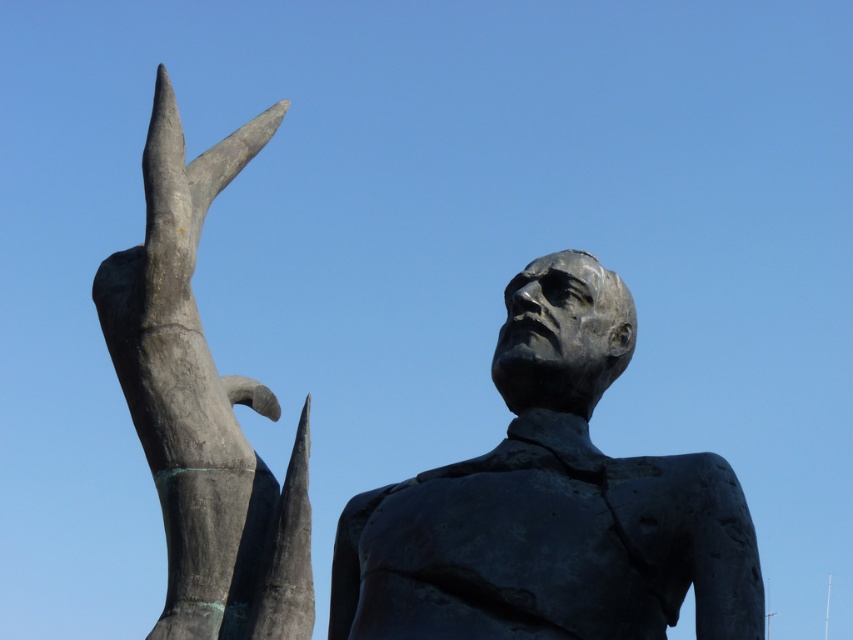
You are a photographer trying to capture the statue in the image. You want to ensure your camera is focused on the bronze statue at upper center. Given that the camera can only focus on objects within a 0.1 radius of the point you select, would the point you chose at point (550, 504) be within the focus range?

The bronze statue at upper center is located exactly at point (550, 504), so the camera will be able to focus on it since the point is within the focus range of 0.1 radius.

You are a tour guide leading a group near two bronze statues. The bronze statue at upper center and the bronze statue at center are in view. Your group asks if they can take a photo that includes both statues in the frame. Based on their distance, can they stand close enough to capture both in one photo?

The bronze statue at upper center is 4.13 meters away from the bronze statue at center. Since the distance between them is moderate, the group can likely position themselves at a point where both statues are within the camera frame, provided they use a wide enough lens or adjust their position accordingly.

You are a maintenance worker responsible for cleaning the bronze statue at center and the bronze hand at upper left. You have a ladder that can reach up to 15 meters. Can you safely clean both objects without needing a taller ladder?

The bronze statue at center and bronze hand at upper left are 18.01 meters apart from each other. Since the ladder can only reach up to 15 meters, you cannot safely clean both objects without needing a taller ladder.